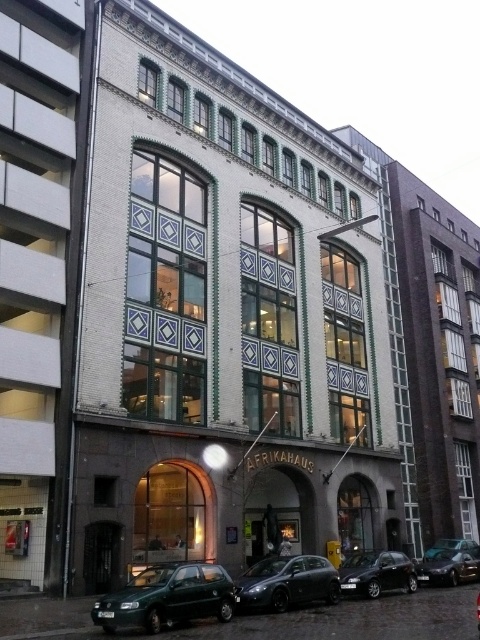
Question: Which point appears farthest from the camera in this image?

Choices:
 (A) (46, 348)
 (B) (135, 122)
 (C) (304, 588)

Answer: (B)

Question: Is matte gray car at center positioned in front of shiny black sedan at center?

Choices:
 (A) no
 (B) yes

Answer: (B)

Question: Which object is closer to the camera taking this photo?

Choices:
 (A) green matte hatchback at lower left
 (B) metallic green hatchback at lower left
 (C) shiny black sedan at lower right

Answer: (A)

Question: Among these points, which one is farthest from the camera?

Choices:
 (A) (47, 433)
 (B) (231, 193)

Answer: (B)

Question: Can you confirm if white tile building at center is positioned to the right of metallic green hatchback at lower left?

Choices:
 (A) yes
 (B) no

Answer: (A)

Question: Does shiny black sedan at center appear over shiny black sedan at lower right?

Choices:
 (A) no
 (B) yes

Answer: (B)